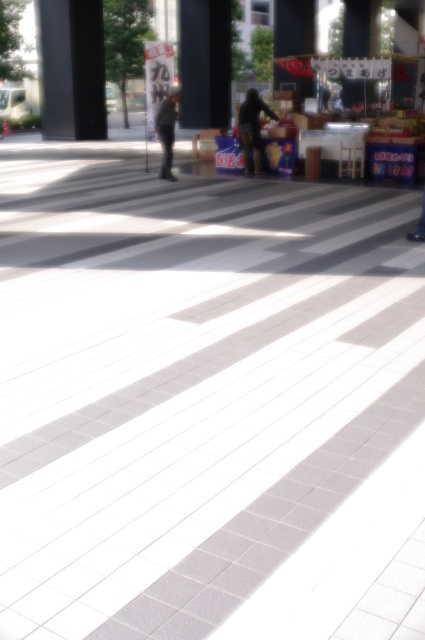
You are a delivery person who needs to deliver a package to the vendor stall in the background. You are currently standing on the tiled floor at the foreground. To reach the stall, you must walk past the dark matte figure at center and the dark gray fabric jacket at center. Which object should you avoid stepping on to ensure you don not trip?

You should avoid stepping on the dark gray fabric jacket at center because the dark matte figure at center is positioned over it, meaning the jacket is on the ground and could be a tripping hazard.